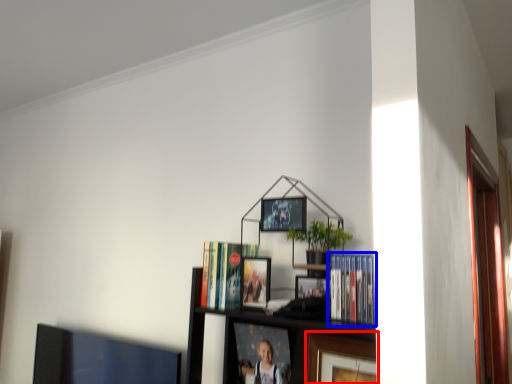
Question: Which object is further to the camera taking this photo, picture frame (highlighted by a red box) or book (highlighted by a blue box)?

Choices:
 (A) picture frame
 (B) book

Answer: (A)